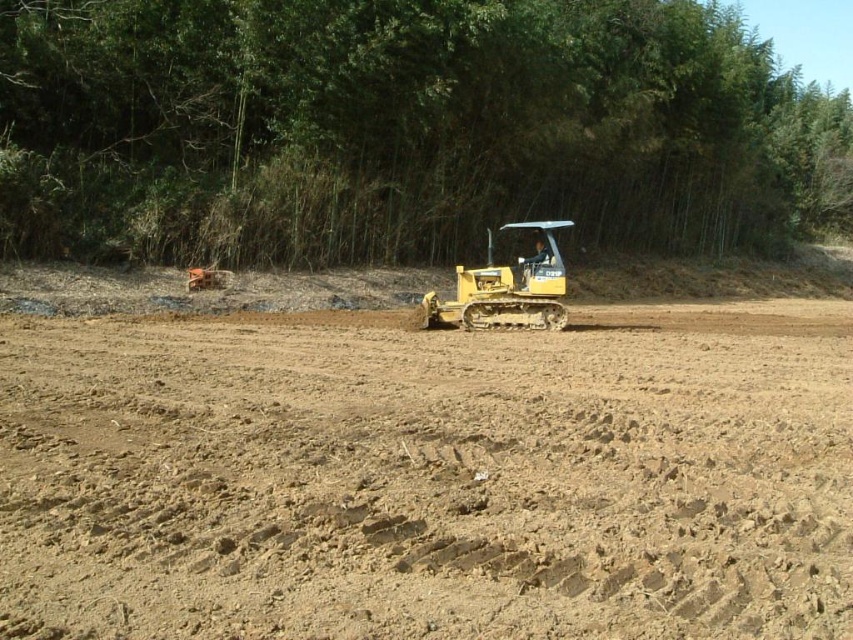
Question: Which object is closer to the camera taking this photo?

Choices:
 (A) green bamboo at upper center
 (B) yellow rubber tractor at center
 (C) brown sandy dirt at center

Answer: (C)

Question: Where is brown sandy dirt at center located in relation to yellow rubber tractor at center in the image?

Choices:
 (A) above
 (B) below

Answer: (B)

Question: Does green bamboo at upper center have a smaller size compared to yellow rubber tractor at center?

Choices:
 (A) yes
 (B) no

Answer: (B)

Question: In this image, where is green bamboo at upper center located relative to yellow rubber tractor at center?

Choices:
 (A) right
 (B) left

Answer: (A)

Question: Which point is closer to the camera taking this photo?

Choices:
 (A) (216, 138)
 (B) (277, 612)
 (C) (502, 298)

Answer: (B)

Question: Which is nearer to the yellow rubber tractor at center?

Choices:
 (A) green bamboo at upper center
 (B) brown sandy dirt at center

Answer: (B)